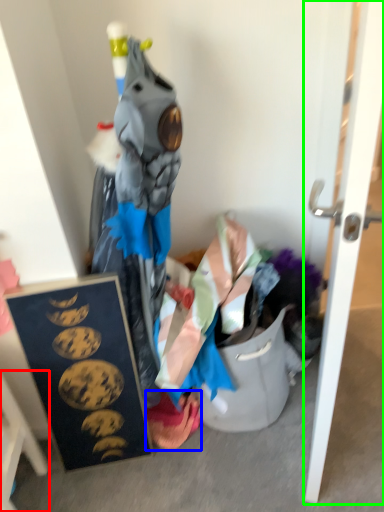
Question: Considering the real-world distances, which object is farthest from furniture (highlighted by a red box)? underclothes (highlighted by a blue box) or door (highlighted by a green box)?

Choices:
 (A) underclothes
 (B) door

Answer: (B)